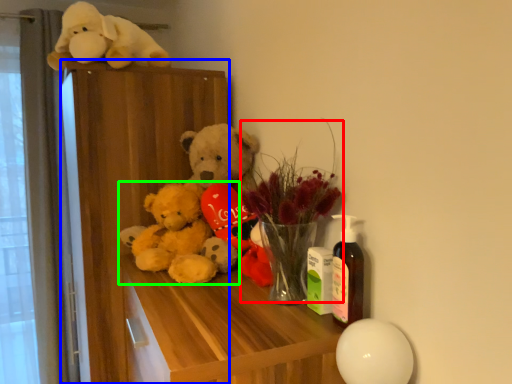
Question: Based on their relative distances, which object is nearer to floral arrangement (highlighted by a red box)? Choose from dresser (highlighted by a blue box) and teddy bear (highlighted by a green box).

Choices:
 (A) dresser
 (B) teddy bear

Answer: (B)